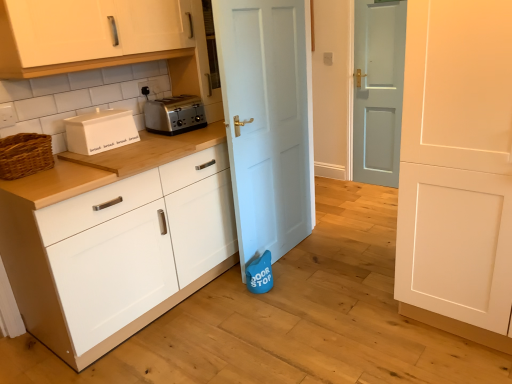
At what (x,y) coordinates should I click in order to perform the action: click on free space in front of white matte cabinet at center, the first cabinetry from the bottom. Please return your answer as a coordinate pair (x, y). Looking at the image, I should click on (209, 342).